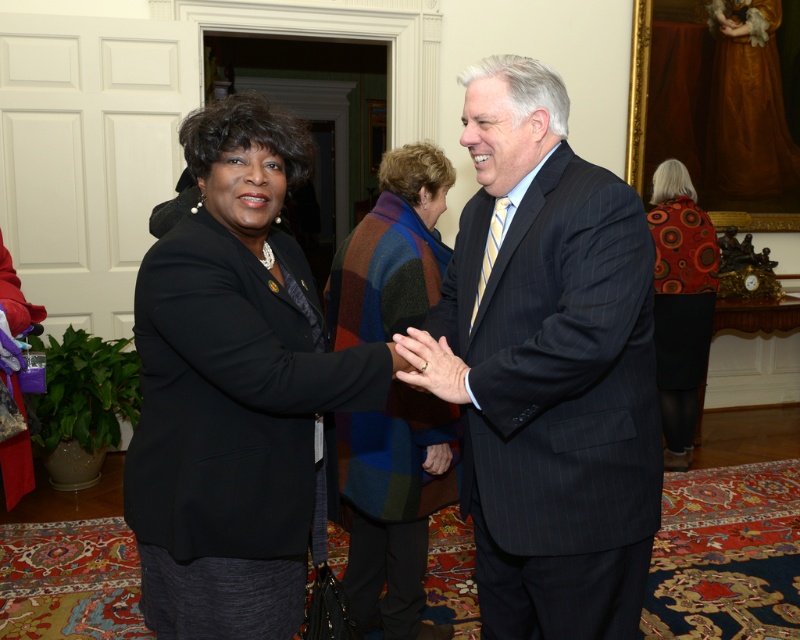
Question: Can you confirm if dark blue pinstripe suit at center is positioned above multicolored woolen shawl at center?

Choices:
 (A) yes
 (B) no

Answer: (A)

Question: Does multicolored woolen shawl at center have a greater width compared to orange patterned sweater at right?

Choices:
 (A) no
 (B) yes

Answer: (B)

Question: Is dark blue pinstripe suit at center further to the viewer compared to multicolored woolen shawl at center?

Choices:
 (A) yes
 (B) no

Answer: (B)

Question: Which of the following is the farthest from the observer?

Choices:
 (A) (386, 193)
 (B) (668, 307)
 (C) (492, 100)
 (D) (218, 224)

Answer: (B)

Question: Which point appears farthest from the camera in this image?

Choices:
 (A) (666, 413)
 (B) (536, 129)

Answer: (A)

Question: Among these objects, which one is farthest from the camera?

Choices:
 (A) multicolored woolen shawl at center
 (B) dark blue pinstripe suit at center

Answer: (A)